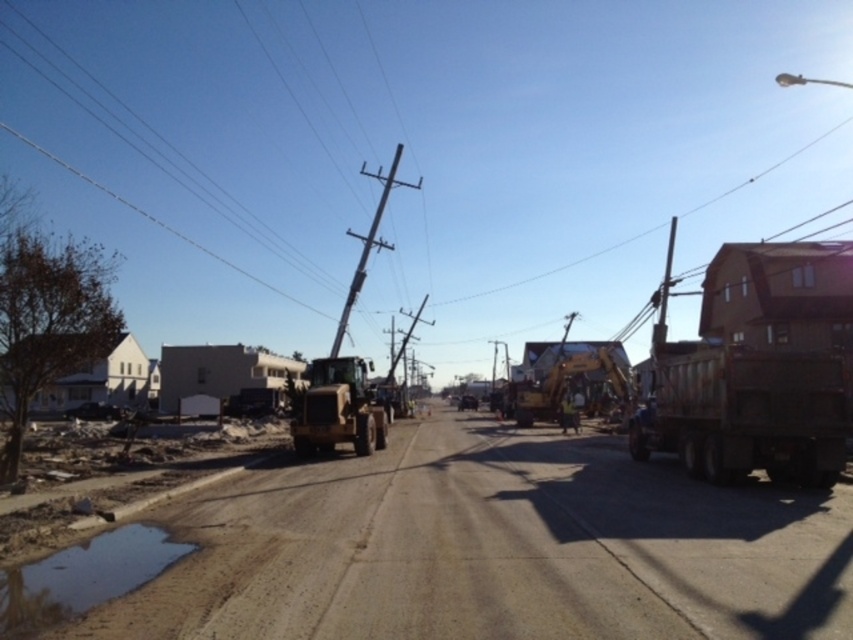
Question: Which point appears farthest from the camera in this image?

Choices:
 (A) (363, 172)
 (B) (740, 461)
 (C) (80, 548)

Answer: (A)

Question: Among these objects, which one is farthest from the camera?

Choices:
 (A) dirt track at center
 (B) rusty metal truck at right
 (C) gold metallic excavator at center
 (D) smooth wood telegraph pole at center

Answer: (D)

Question: Is dirt track at center wider than gold metallic excavator at center?

Choices:
 (A) no
 (B) yes

Answer: (B)

Question: Can you confirm if gold metallic excavator at center is positioned below smooth wood telegraph pole at center?

Choices:
 (A) no
 (B) yes

Answer: (B)

Question: Which of the following is the closest to the observer?

Choices:
 (A) (337, 358)
 (B) (126, 582)
 (C) (363, 253)

Answer: (B)

Question: Can you confirm if dirt track at center is positioned to the right of smooth wood telegraph pole at center?

Choices:
 (A) no
 (B) yes

Answer: (B)